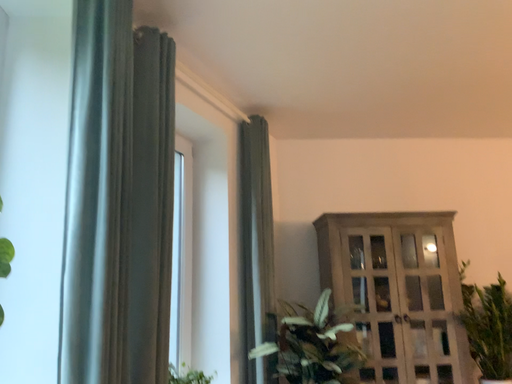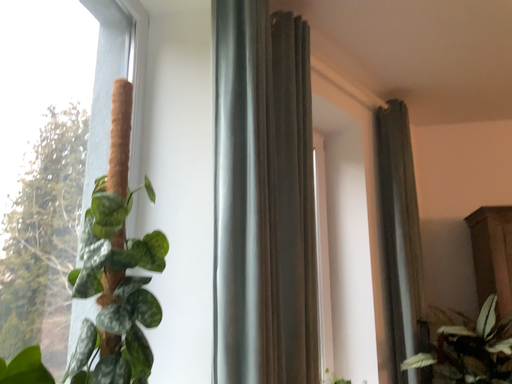
Question: Which way did the camera rotate in the video?

Choices:
 (A) rotated right
 (B) rotated left

Answer: (B)